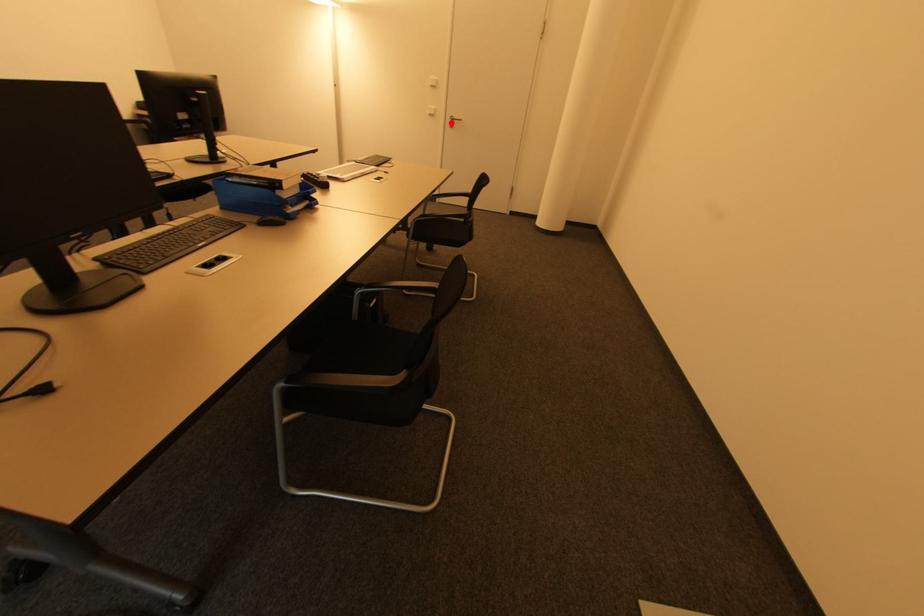
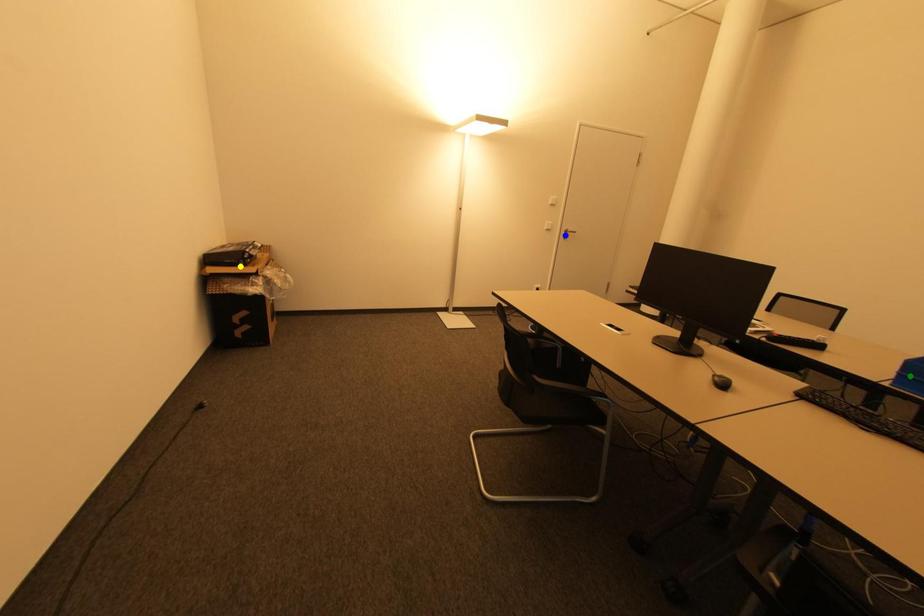
Question: I am providing you with two images of the same scene from different viewpoints. A red point is marked on the first image. You are given multiple points on the second image. In image 2, which mark is for the same physical point as the one in image 1?

Choices:
 (A) blue point
 (B) yellow point
 (C) green point

Answer: (A)